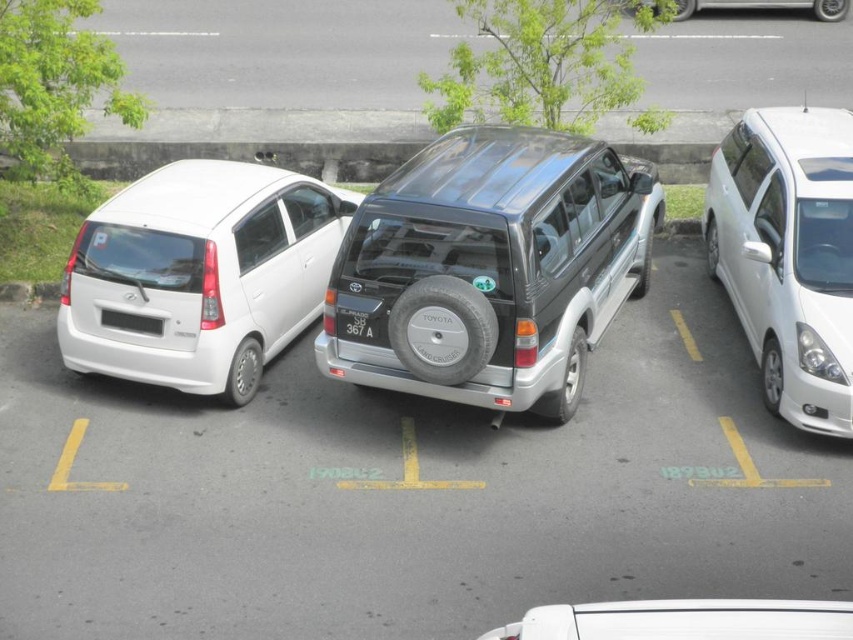
Question: Is metallic silver car at upper right to the right of black plastic license plate at rear from the viewer's perspective?

Choices:
 (A) yes
 (B) no

Answer: (A)

Question: Is satin silver suv at center below white glossy minivan at right?

Choices:
 (A) no
 (B) yes

Answer: (A)

Question: Estimate the real-world distances between objects in this image. Which object is farther from the black plastic license plate at center?

Choices:
 (A) metallic silver car at upper right
 (B) satin silver suv at center

Answer: (A)

Question: Does white matte hatchback at left appear under white matte car at center?

Choices:
 (A) yes
 (B) no

Answer: (B)

Question: Which point is closer to the camera taking this photo?

Choices:
 (A) (376, 336)
 (B) (518, 170)
 (C) (213, 262)
 (D) (103, 321)

Answer: (A)

Question: Among these objects, which one is farthest from the camera?

Choices:
 (A) white matte hatchback at left
 (B) satin silver suv at center

Answer: (A)